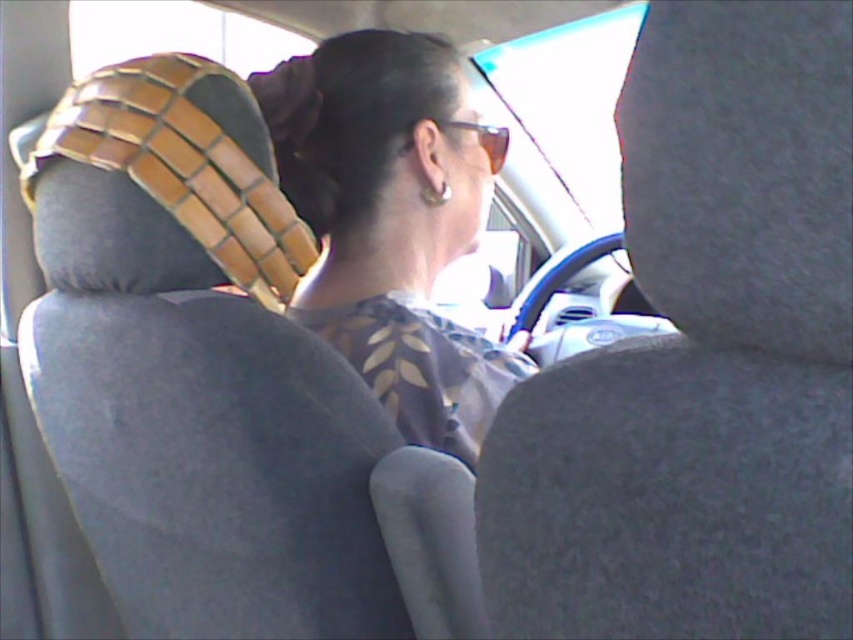
Question: Is matte gray shirt at center further to the viewer compared to black woven hair at upper center?

Choices:
 (A) yes
 (B) no

Answer: (B)

Question: Considering the relative positions of black woven hair at upper center and sunglasses at center in the image provided, where is black woven hair at upper center located with respect to sunglasses at center?

Choices:
 (A) above
 (B) below

Answer: (B)

Question: Which object is closer to the camera taking this photo?

Choices:
 (A) matte gray shirt at center
 (B) black woven hair at upper center
 (C) gray fabric seat at center

Answer: (C)

Question: In this image, where is gray fabric seat at center located relative to black woven hair at upper center?

Choices:
 (A) left
 (B) right

Answer: (B)

Question: Considering the real-world distances, which object is farthest from the matte gray shirt at center?

Choices:
 (A) gray fabric seat at center
 (B) black woven hair at upper center

Answer: (A)

Question: Which of these objects is positioned farthest from the black woven hair at upper center?

Choices:
 (A) matte gray shirt at center
 (B) sunglasses at center
 (C) gray fabric seat at center

Answer: (C)